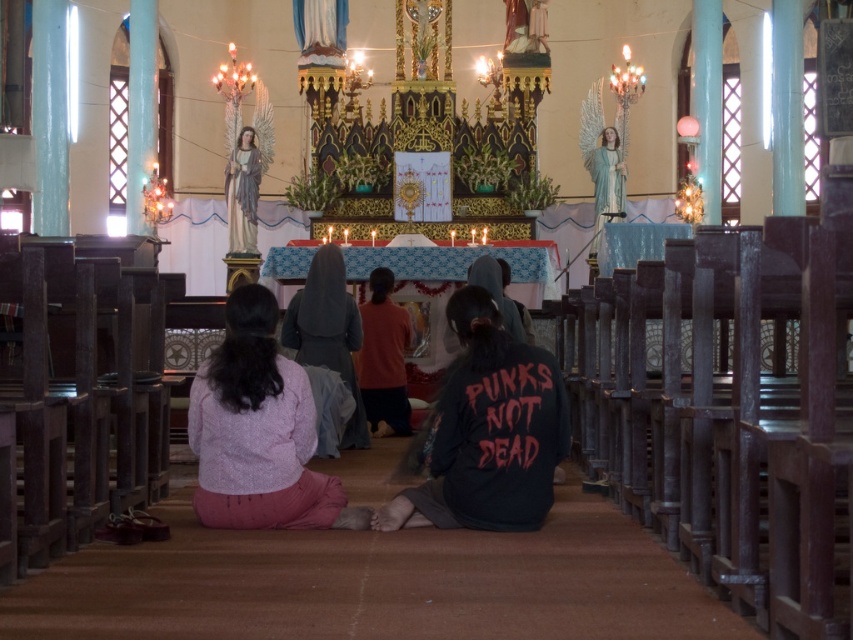
Can you confirm if pink fabric skirt at lower center is smaller than matte gray statue at upper center?

Incorrect, pink fabric skirt at lower center is not smaller in size than matte gray statue at upper center.

Who is more forward, [254,288] or [248,193]?

Point [254,288] is in front.

Find the location of a particular element. pink fabric skirt at lower center is located at coordinates tap(259, 432).

Does black matte sweatshirt at center lie in front of pink fabric skirt at lower center?

No.

Locate an element on the screen. Image resolution: width=853 pixels, height=640 pixels. black matte sweatshirt at center is located at coordinates (486, 433).

The height and width of the screenshot is (640, 853). Find the location of `black matte sweatshirt at center`. black matte sweatshirt at center is located at coordinates (486, 433).

Is dark gray fabric at center positioned behind matte gray statue at upper center?

No, dark gray fabric at center is in front of matte gray statue at upper center.

Between dark gray fabric at center and matte gray statue at upper center, which one is positioned higher?

matte gray statue at upper center is higher up.

Does point (335, 244) come farther from viewer compared to point (227, 184)?

No, it is not.

At what (x,y) coordinates should I click in order to perform the action: click on dark gray fabric at center. Please return your answer as a coordinate pair (x, y). The width and height of the screenshot is (853, 640). Looking at the image, I should click on (328, 332).